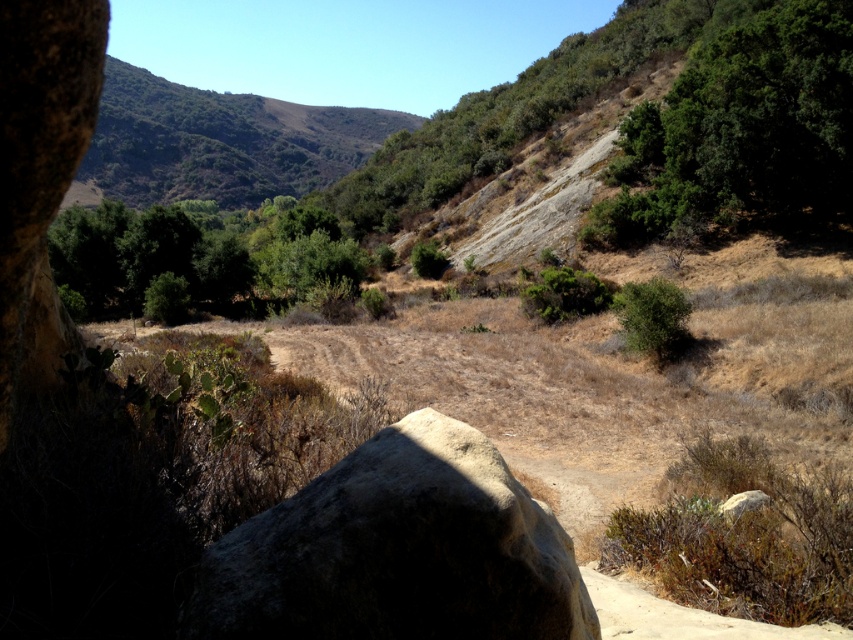
Does dark gray rough boulder at center appear on the right side of green leafy shrub at center-right?

In fact, dark gray rough boulder at center is to the left of green leafy shrub at center-right.

Who is positioned more to the left, dark gray rough boulder at center or green leafy shrub at center-right?

dark gray rough boulder at center

Does point (219, 593) come in front of point (679, 348)?

Yes, it is in front of point (679, 348).

Identify the location of dark gray rough boulder at center. (397, 552).

Can you confirm if green leafy tree at center is shorter than green leafy shrub at center-right?

No, green leafy tree at center is not shorter than green leafy shrub at center-right.

Is green leafy tree at center positioned before green leafy shrub at center-right?

That is False.

Is point (260, 237) closer to viewer compared to point (627, 316)?

No, it is behind (627, 316).

Find the location of `green leafy tree at center`. green leafy tree at center is located at coordinates (206, 259).

Does green leafy tree at center have a larger size compared to green leafy bush at center?

Yes.

Is green leafy tree at center to the right of green leafy bush at center from the viewer's perspective?

Incorrect, green leafy tree at center is not on the right side of green leafy bush at center.

This screenshot has height=640, width=853. Identify the location of green leafy tree at center. (206, 259).